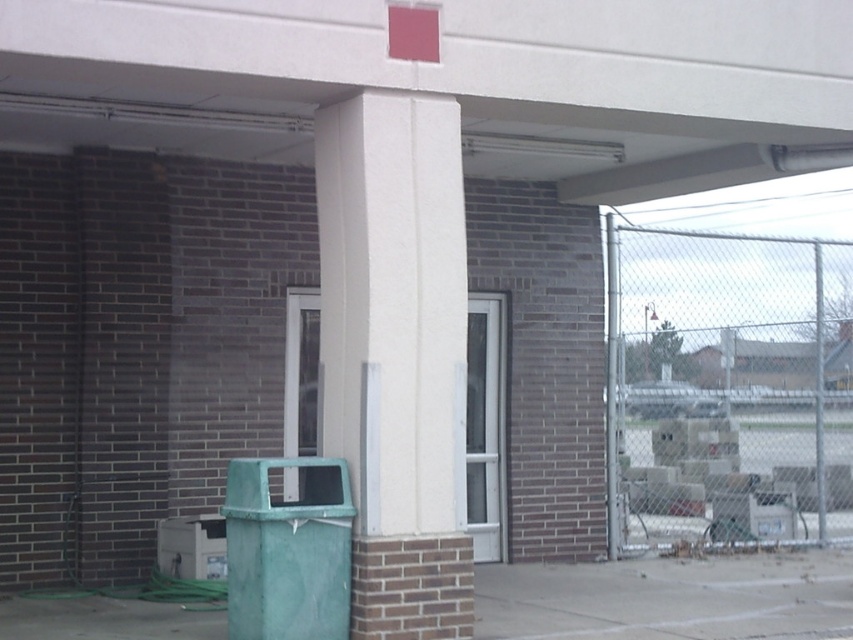
You are standing at the entrance of the building and want to reach the green trash bin. There is a metal chain link fence at right located at point (727, 388). Can you walk directly to the trash bin without crossing any obstacles?

The metal chain link fence at right is located at point (727, 388), so you can walk directly to the green trash bin without crossing any obstacles as the fence is positioned to the right of the column and not blocking the path.